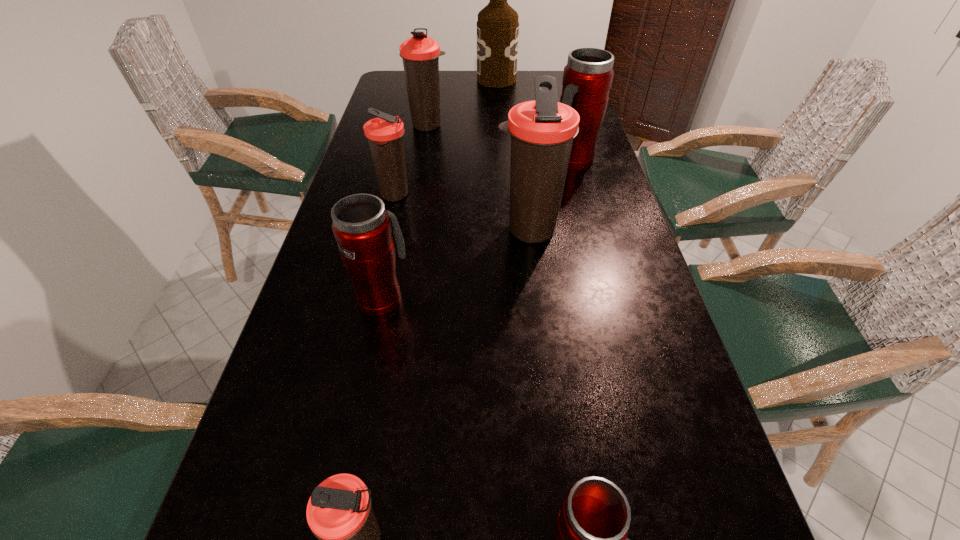
Identify which red thermos bottle is the third closest to the farthest object. Please provide its 2D coordinates. Your answer should be formatted as a tuple, i.e. [(x, y)], where the tuple contains the x and y coordinates of a point satisfying the conditions above.

[(592, 526)]